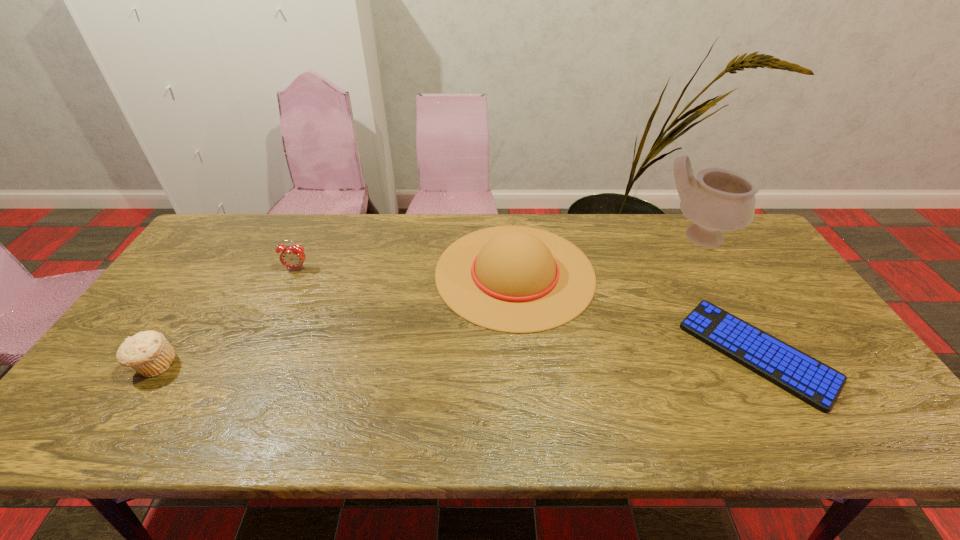
Identify the location of pottery. (718, 200).

Identify the location of sombrero. The height and width of the screenshot is (540, 960). (514, 279).

Identify the location of alarm clock. (293, 257).

The height and width of the screenshot is (540, 960). I want to click on the leftmost object, so click(149, 353).

Find the location of a particular element. computer keyboard is located at coordinates (817, 384).

This screenshot has height=540, width=960. What are the coordinates of `free space located on the front of the tallest object` in the screenshot? It's located at (722, 276).

The image size is (960, 540). Find the location of `free spot located 0.230m on the front of the third object from left to right`. free spot located 0.230m on the front of the third object from left to right is located at coordinates (527, 411).

Find the location of a particular element. The height and width of the screenshot is (540, 960). vacant point located 0.050m on the face of the second object from left to right is located at coordinates (290, 284).

The image size is (960, 540). What are the coordinates of `free region located on the back of the muffin` in the screenshot? It's located at (231, 251).

Identify the location of free space located on the back of the shortest object. click(712, 276).